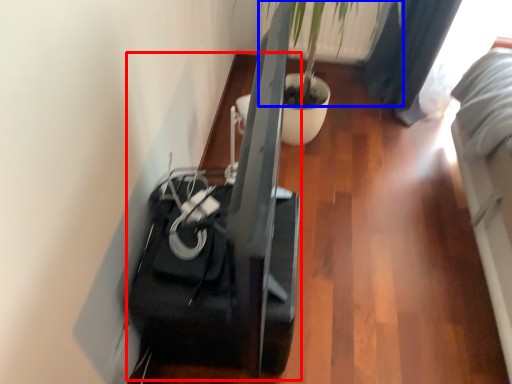
Question: Which object appears farthest to the camera in this image, furniture (highlighted by a red box) or plant (highlighted by a blue box)?

Choices:
 (A) furniture
 (B) plant

Answer: (B)